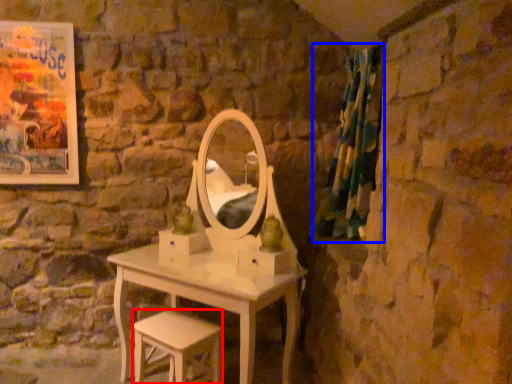
Question: Which object appears closest to the camera in this image, stool (highlighted by a red box) or curtain (highlighted by a blue box)?

Choices:
 (A) stool
 (B) curtain

Answer: (A)